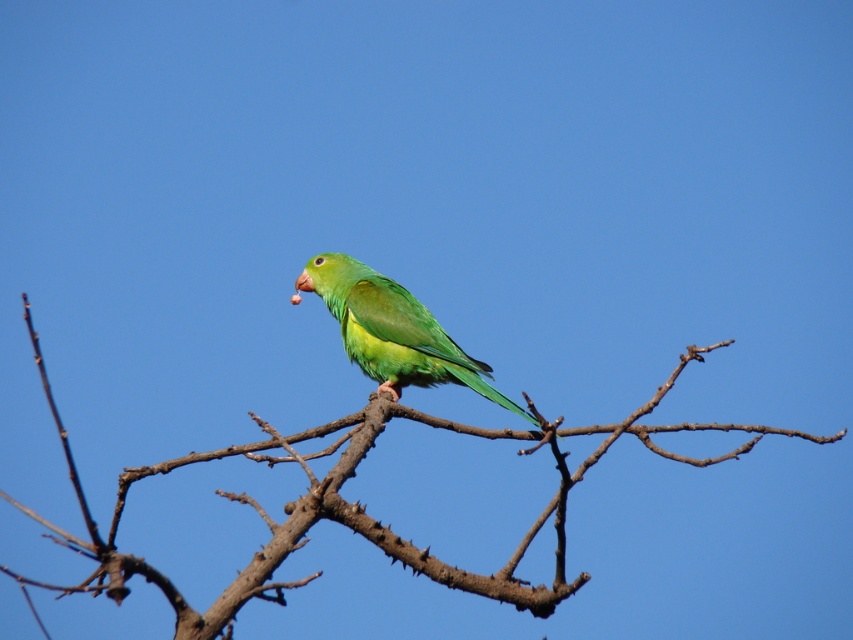
Can you confirm if brown rough branch at center is taller than green matte parrot at center?

Yes.

Is brown rough branch at center wider than green matte parrot at center?

Yes.

Locate an element on the screen. The image size is (853, 640). brown rough branch at center is located at coordinates (354, 506).